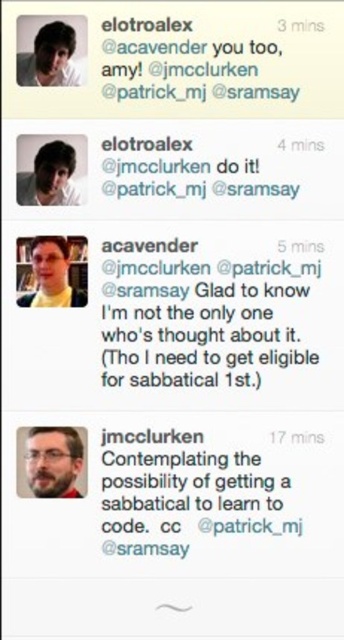
You are looking at a social media interface and see the black matte tweet at upper center. What is the 2D coordinate of this tweet?

The black matte tweet at upper center is located at the 2D coordinate point of (186, 64).

You are standing 10 feet away from the screen displaying the social media conversation. The black matte tweet at upper center and the bearded man at center are both visible. According to the description, which object is closer to you?

The black matte tweet at upper center is closer to you because it is 20.56 inches away from the bearded man at center, meaning it is positioned in front of or nearer to your viewpoint compared to the bearded man at center.

Consider the image. You are designing a digital interface for visually impaired users and need to ensure accessibility. The black matte tweet at upper center and the matte black hair at upper left are both dark elements. Given that the minimum required spacing between dark elements for accessibility standards is 20 centimeters, can these two elements be placed closer together without violating the standard?

The black matte tweet at upper center and matte black hair at upper left are 18.59 centimeters apart, which is less than the required 20 centimeters. Therefore, they violate the accessibility standard and should be spaced further apart.